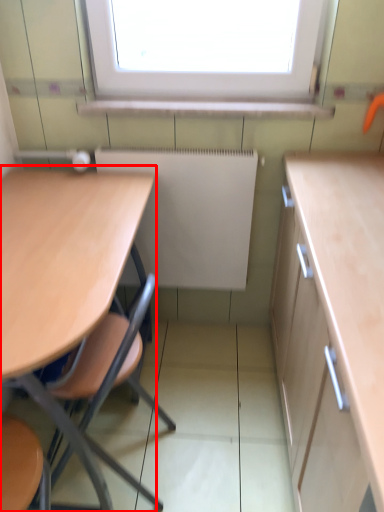
Question: From the image's perspective, where is table (annotated by the red box) located in relation to radiator in the image?

Choices:
 (A) below
 (B) above

Answer: (A)